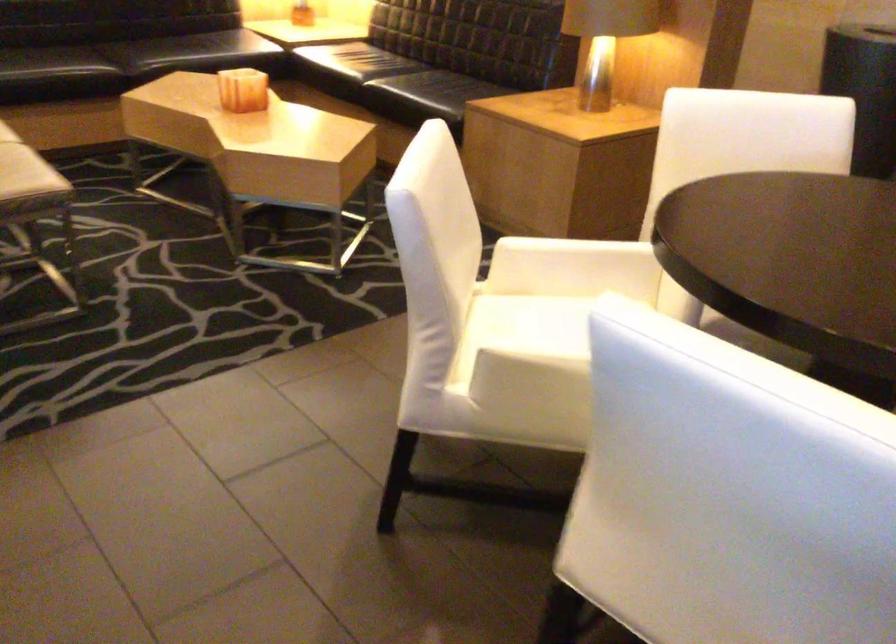
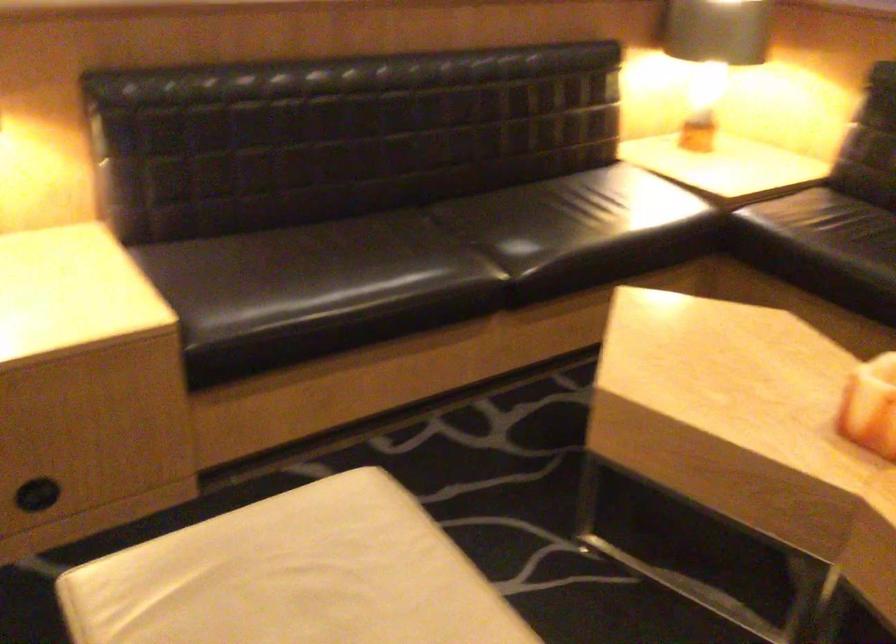
The images are taken continuously from a first-person perspective. In which direction are you moving?

The cameraman moved toward left, forward.